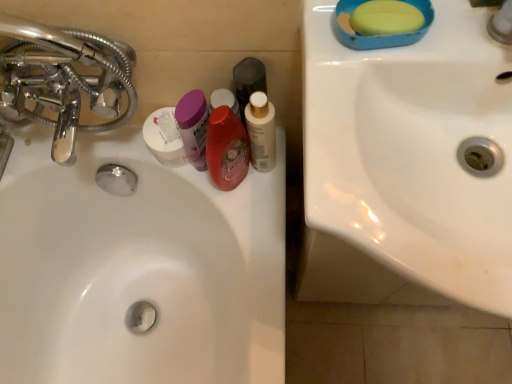
Question: From the image's perspective, is yellow matte soap at upper right above black matte bottle at center, which is the 3th mouthwash in left-to-right order?

Choices:
 (A) no
 (B) yes

Answer: (B)

Question: Are yellow matte soap at upper right and black matte bottle at center, the 2th mouthwash in the right-to-left sequence, located far from each other?

Choices:
 (A) yes
 (B) no

Answer: (B)

Question: From a real-world perspective, is yellow matte soap at upper right physically above black matte bottle at center, the 2th mouthwash in the right-to-left sequence?

Choices:
 (A) yes
 (B) no

Answer: (A)

Question: Is black matte bottle at center, which is the 3th mouthwash in left-to-right order, at the back of yellow matte soap at upper right?

Choices:
 (A) no
 (B) yes

Answer: (A)

Question: Is yellow matte soap at upper right directly adjacent to black matte bottle at center, the 2th mouthwash in the right-to-left sequence?

Choices:
 (A) yes
 (B) no

Answer: (B)

Question: Does yellow matte soap at upper right come behind black matte bottle at center, the 2th mouthwash in the right-to-left sequence?

Choices:
 (A) no
 (B) yes

Answer: (A)

Question: Considering the relative positions of white glossy sink at center, which is the 2th sink in right-to-left order, and white glossy mouthwash at center, the 4th mouthwash when ordered from left to right, in the image provided, is white glossy sink at center, which is the 2th sink in right-to-left order, to the right of white glossy mouthwash at center, the 4th mouthwash when ordered from left to right, from the viewer's perspective?

Choices:
 (A) no
 (B) yes

Answer: (A)

Question: Is white glossy sink at center, arranged as the second sink when viewed from the front, positioned beyond the bounds of white glossy mouthwash at center, the 4th mouthwash when ordered from left to right?

Choices:
 (A) yes
 (B) no

Answer: (A)

Question: From a real-world perspective, is white glossy sink at center, placed as the 1th sink when sorted from left to right, located higher than white glossy mouthwash at center, the 4th mouthwash when ordered from left to right?

Choices:
 (A) no
 (B) yes

Answer: (A)

Question: Is white glossy sink at center, which appears as the 1th sink when viewed from the back, to the left of white glossy mouthwash at center, the 4th mouthwash when ordered from left to right, from the viewer's perspective?

Choices:
 (A) no
 (B) yes

Answer: (B)

Question: Considering the relative positions of white glossy sink at center, which appears as the 1th sink when viewed from the back, and white glossy mouthwash at center, the 4th mouthwash when ordered from left to right, in the image provided, is white glossy sink at center, which appears as the 1th sink when viewed from the back, in front of white glossy mouthwash at center, the 4th mouthwash when ordered from left to right,?

Choices:
 (A) no
 (B) yes

Answer: (A)

Question: Is white glossy sink at center, placed as the 1th sink when sorted from left to right, aimed at white glossy mouthwash at center, the 1th mouthwash viewed from the right?

Choices:
 (A) yes
 (B) no

Answer: (B)

Question: Is purple plastic container at center, the first mouthwash positioned from the left, bigger than white matte container at center?

Choices:
 (A) yes
 (B) no

Answer: (B)